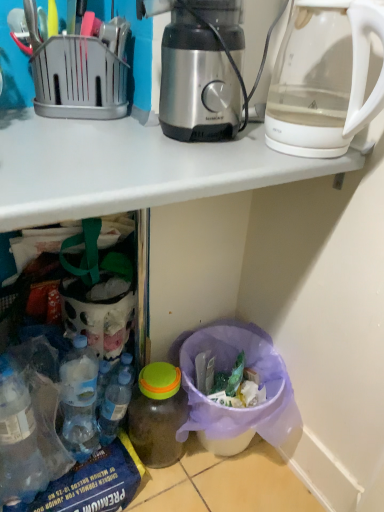
Question: Does stainless steel coffee maker at center touch transparent glass kettle at upper right?

Choices:
 (A) yes
 (B) no

Answer: (B)

Question: Is the position of stainless steel coffee maker at center more distant than that of transparent glass kettle at upper right?

Choices:
 (A) yes
 (B) no

Answer: (A)

Question: From a real-world perspective, is stainless steel coffee maker at center located higher than transparent glass kettle at upper right?

Choices:
 (A) no
 (B) yes

Answer: (A)

Question: Would you say stainless steel coffee maker at center is outside transparent glass kettle at upper right?

Choices:
 (A) yes
 (B) no

Answer: (A)

Question: From the image's perspective, is stainless steel coffee maker at center above transparent glass kettle at upper right?

Choices:
 (A) yes
 (B) no

Answer: (A)

Question: Is stainless steel coffee maker at center turned away from transparent glass kettle at upper right?

Choices:
 (A) yes
 (B) no

Answer: (B)

Question: Is blue translucent bottle at lower left, the second bottle positioned from the right, wider than translucent plastic bottle at lower center, the second bottle when ordered from left to right?

Choices:
 (A) no
 (B) yes

Answer: (A)

Question: Is blue translucent bottle at lower left, the 1th bottle from the left, at the left side of translucent plastic bottle at lower center, the second bottle when ordered from left to right?

Choices:
 (A) yes
 (B) no

Answer: (A)

Question: Is blue translucent bottle at lower left, the 1th bottle from the left, not close to translucent plastic bottle at lower center, the second bottle when ordered from left to right?

Choices:
 (A) no
 (B) yes

Answer: (A)

Question: From a real-world perspective, is blue translucent bottle at lower left, the second bottle positioned from the right, on top of translucent plastic bottle at lower center, the second bottle when ordered from left to right?

Choices:
 (A) no
 (B) yes

Answer: (B)

Question: From the image's perspective, is blue translucent bottle at lower left, the 1th bottle from the left, located above translucent plastic bottle at lower center, the second bottle when ordered from left to right?

Choices:
 (A) no
 (B) yes

Answer: (B)

Question: From a real-world perspective, is blue translucent bottle at lower left, the 1th bottle from the left, beneath translucent plastic bottle at lower center, marked as the first bottle in a right-to-left arrangement?

Choices:
 (A) no
 (B) yes

Answer: (A)

Question: From the image's perspective, is translucent plastic bottle at lower center, the second bottle when ordered from left to right, below stainless steel coffee maker at center?

Choices:
 (A) yes
 (B) no

Answer: (A)